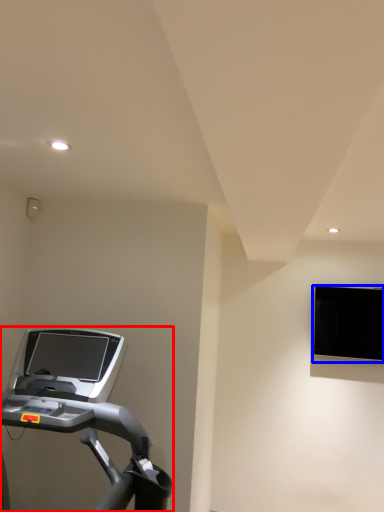
Question: Which object is closer to the camera taking this photo, treadmill (highlighted by a red box) or computer monitor (highlighted by a blue box)?

Choices:
 (A) treadmill
 (B) computer monitor

Answer: (A)